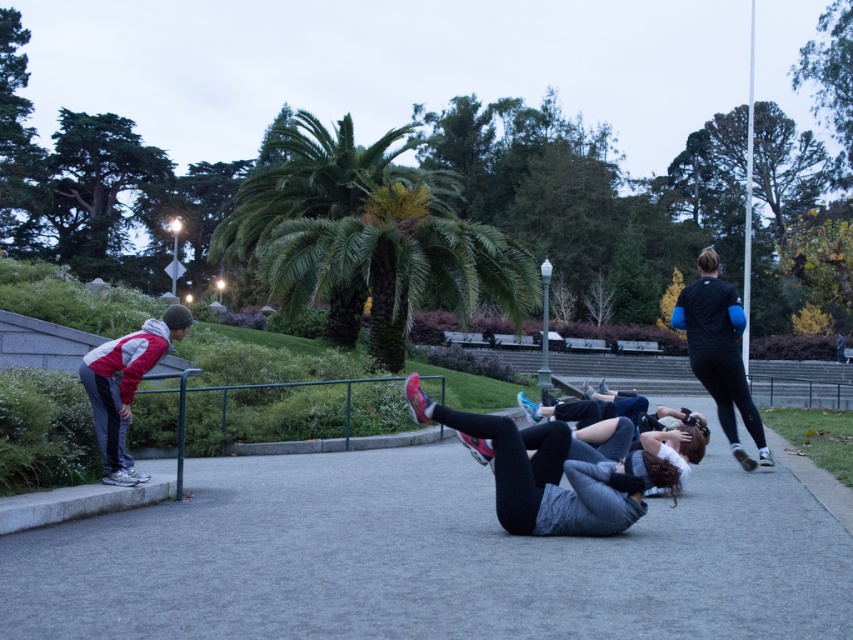
You are standing at the point marked by coordinates point [550,474] in the image. Looking around, you see gray fabric leggings at center. What object is directly beneath your feet?

The point [550,474] is on gray fabric leggings at center, so the gray fabric leggings at center are directly beneath your feet.

You are standing at the edge of the park and want to walk to the gray asphalt pavement at center. According to the coordinates provided, what direction should you head in to reach it?

The gray asphalt pavement at center is located at coordinates point (428, 557), so you should head east to reach it.

You are a park visitor carrying a large picnic basket. You want to place it on the gray asphalt pavement at center and the gray fabric leggings at center. Which surface is more suitable for placing the basket?

The gray asphalt pavement at center is more suitable for placing the picnic basket because it is a solid surface, whereas the gray fabric leggings at center are a flexible material and might not support the weight of the basket.